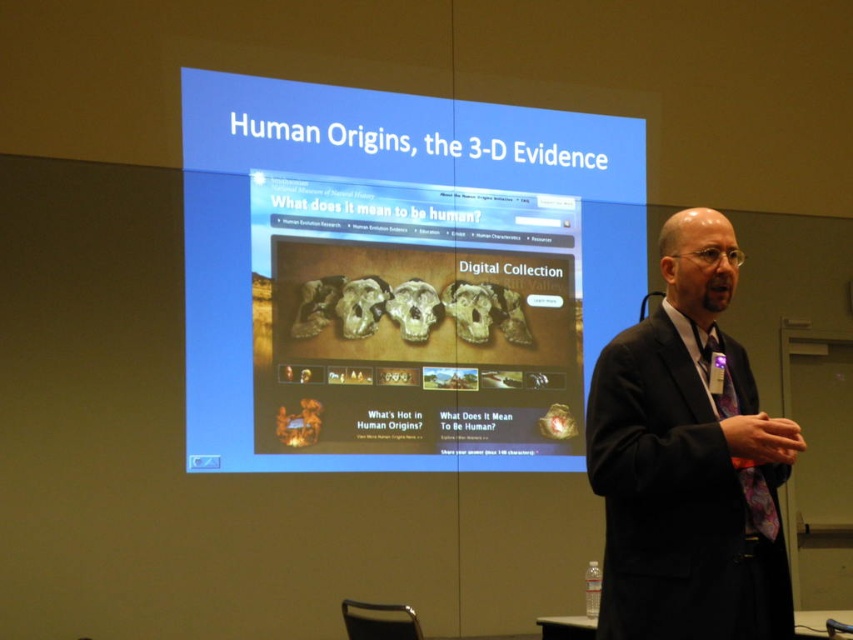
In the scene shown: user is a photographer who needs to capture a close up of the purple floral tie at right without the matte digital display at center being visible in the frame. Is this possible?

The matte digital display at center is bigger than purple floral tie at right. Since the display is larger, it might block the view of the tie if they are positioned in a way that the display is between the camera and the tie. However, the question states the photographer wants to capture the tie without the display visible. To achieve this, the photographer could adjust the angle or position to frame the tie such that the display is out of the shot. Since the display is at center and the tie is at right, a

You are an attendee at the presentation and want to take a photo of both the matte digital display at center and the purple floral tie at right. However, your phone camera has a limited field of view. Can you fit both objects in the frame without moving your phone?

The matte digital display at center is wider than the purple floral tie at right, so you can fit both objects in the frame since the display is wider and likely occupies more space, allowing the tie to be included alongside it.

You are an attendee at the presentation and want to take a photo of the speaker. The camera you have can only focus on objects within a 0.5 unit radius from the center point. Is the black suit at center within the focus range of your camera?

The position of black suit at center is at point (688,460). The distance from the center point is sqrt. Since the focus range is 0.5 units, the black suit at center is outside the focus range and cannot be captured clearly.